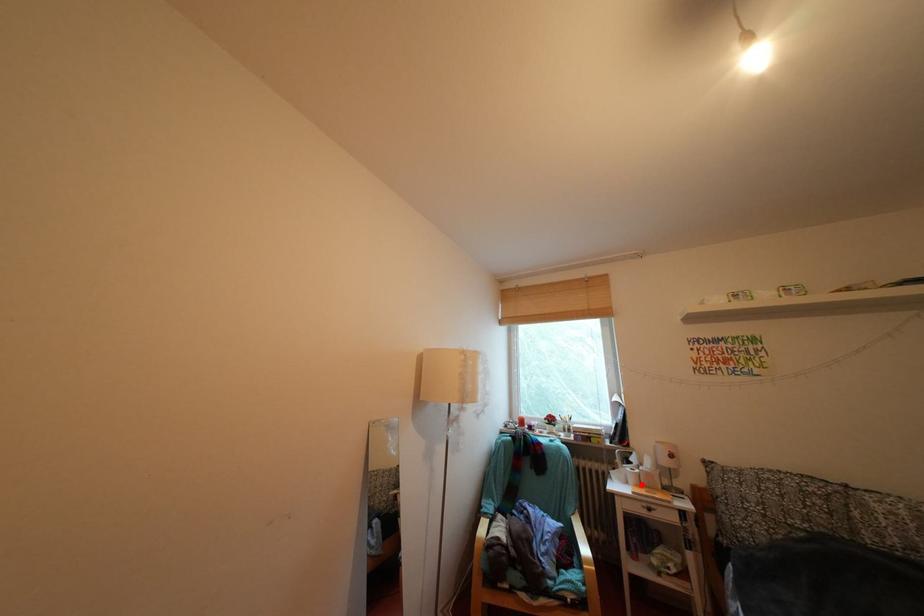
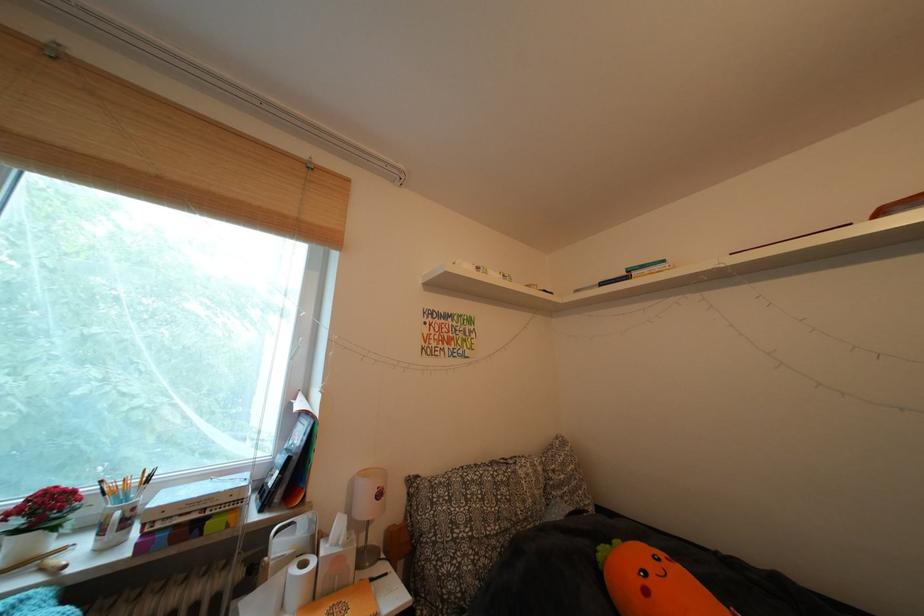
Question: I am providing you with two images of the same scene from different viewpoints. In image1, a red point is highlighted. Considering the same 3D point in image2, which of the following is correct?

Choices:
 (A) It is closer
 (B) It is farther

Answer: (A)